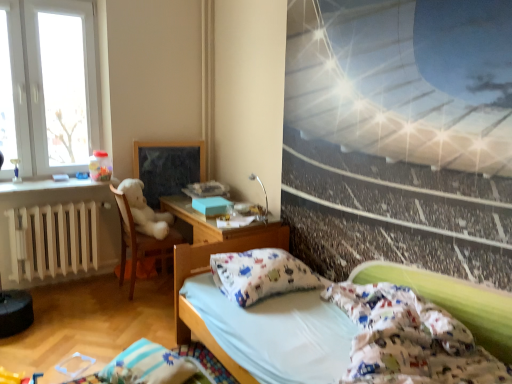
Question: Looking at their shapes, would you say blue striped pillow at lower left, the 2th pillow in the right-to-left sequence, is wider or thinner than white matte radiator at left?

Choices:
 (A) thin
 (B) wide

Answer: (B)

Question: Is blue striped pillow at lower left, acting as the 1th pillow starting from the bottom, bigger or smaller than white matte radiator at left?

Choices:
 (A) small
 (B) big

Answer: (A)

Question: Which of these objects is positioned closest to the white cotton bed at lower right?

Choices:
 (A) white cotton pillow at center, marked as the second pillow in a left-to-right arrangement
 (B) matte black picture frame at center
 (C) blue striped pillow at lower left, arranged as the 1th pillow when viewed from the left
 (D) white glass window at upper left
 (E) white matte radiator at left

Answer: (A)

Question: Based on their relative distances, which object is nearer to the white matte radiator at left?

Choices:
 (A) matte black picture frame at center
 (B) white glass window at upper left
 (C) blue striped pillow at lower left, the 2th pillow in the right-to-left sequence
 (D) white cotton bed at lower right
 (E) white cotton pillow at center, which is the 1th pillow from top to bottom

Answer: (A)